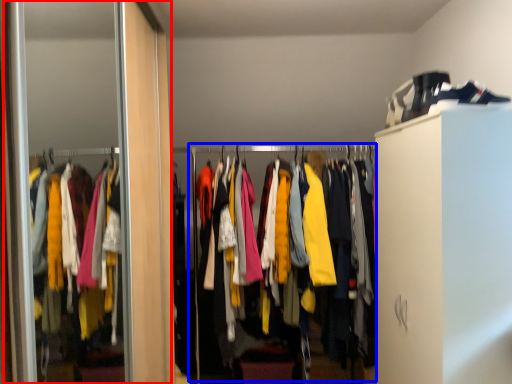
Question: Which point is further to the camera, screen door (highlighted by a red box) or closet (highlighted by a blue box)?

Choices:
 (A) screen door
 (B) closet

Answer: (B)